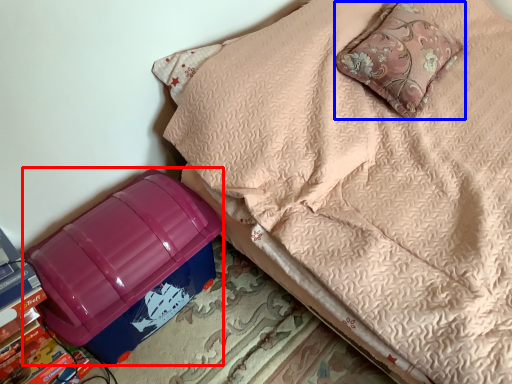
Question: Which of the following is the closest to the observer, storage box (highlighted by a red box) or pillow (highlighted by a blue box)?

Choices:
 (A) storage box
 (B) pillow

Answer: (A)